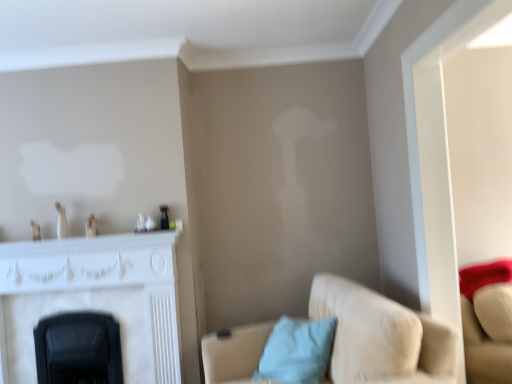
Question: From a real-world perspective, is white marble fireplace at left over suede beige couch at lower right?

Choices:
 (A) yes
 (B) no

Answer: (A)

Question: Is white marble fireplace at left far away from suede beige couch at lower right?

Choices:
 (A) no
 (B) yes

Answer: (B)

Question: Is the position of white marble fireplace at left more distant than that of suede beige couch at lower right?

Choices:
 (A) yes
 (B) no

Answer: (A)

Question: Are white marble fireplace at left and suede beige couch at lower right beside each other?

Choices:
 (A) yes
 (B) no

Answer: (B)

Question: From the image's perspective, would you say white marble fireplace at left is shown under suede beige couch at lower right?

Choices:
 (A) yes
 (B) no

Answer: (B)

Question: Can suede beige couch at lower right be found inside white marble fireplace at left?

Choices:
 (A) no
 (B) yes

Answer: (A)

Question: Is light blue fabric pillow at lower center positioned in front of suede beige couch at lower right?

Choices:
 (A) yes
 (B) no

Answer: (B)

Question: Considering the relative sizes of light blue fabric pillow at lower center and suede beige couch at lower right in the image provided, is light blue fabric pillow at lower center thinner than suede beige couch at lower right?

Choices:
 (A) no
 (B) yes

Answer: (B)

Question: Does light blue fabric pillow at lower center turn towards suede beige couch at lower right?

Choices:
 (A) yes
 (B) no

Answer: (A)

Question: Does light blue fabric pillow at lower center appear on the left side of suede beige couch at lower right?

Choices:
 (A) yes
 (B) no

Answer: (A)

Question: Is the position of light blue fabric pillow at lower center more distant than that of suede beige couch at lower right?

Choices:
 (A) no
 (B) yes

Answer: (B)

Question: Does light blue fabric pillow at lower center have a greater width compared to suede beige couch at lower right?

Choices:
 (A) no
 (B) yes

Answer: (A)

Question: Is light blue fabric pillow at lower center outside white marble fireplace at left?

Choices:
 (A) no
 (B) yes

Answer: (B)